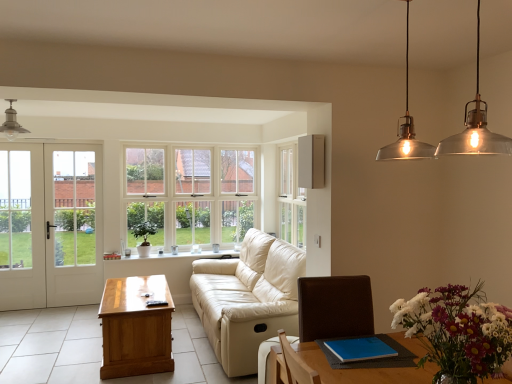
Question: From the image's perspective, is light beige leather armchair at lower center above matte silver light fixture at upper left?

Choices:
 (A) yes
 (B) no

Answer: (B)

Question: From a real-world perspective, is light beige leather armchair at lower center beneath matte silver light fixture at upper left?

Choices:
 (A) yes
 (B) no

Answer: (A)

Question: Would you say light beige leather armchair at lower center is outside matte silver light fixture at upper left?

Choices:
 (A) no
 (B) yes

Answer: (B)

Question: Considering the relative sizes of light beige leather armchair at lower center and matte silver light fixture at upper left in the image provided, is light beige leather armchair at lower center shorter than matte silver light fixture at upper left?

Choices:
 (A) yes
 (B) no

Answer: (B)

Question: Can you confirm if light beige leather armchair at lower center is thinner than matte silver light fixture at upper left?

Choices:
 (A) no
 (B) yes

Answer: (A)

Question: Is matte silver light fixture at upper left located within light beige leather armchair at lower center?

Choices:
 (A) no
 (B) yes

Answer: (A)

Question: Is white glossy window sill at center located outside white glass door at left?

Choices:
 (A) no
 (B) yes

Answer: (B)

Question: Is white glossy window sill at center looking in the opposite direction of white glass door at left?

Choices:
 (A) yes
 (B) no

Answer: (B)

Question: Could you tell me if white glossy window sill at center is turned towards white glass door at left?

Choices:
 (A) no
 (B) yes

Answer: (A)

Question: Is white glossy window sill at center bigger than white glass door at left?

Choices:
 (A) no
 (B) yes

Answer: (A)

Question: From the image's perspective, would you say white glossy window sill at center is positioned over white glass door at left?

Choices:
 (A) no
 (B) yes

Answer: (A)

Question: Does white glossy window sill at center have a lesser width compared to white glass door at left?

Choices:
 (A) yes
 (B) no

Answer: (B)

Question: From a real-world perspective, is white glass window at center below multicolored floral bouquet at lower right?

Choices:
 (A) yes
 (B) no

Answer: (B)